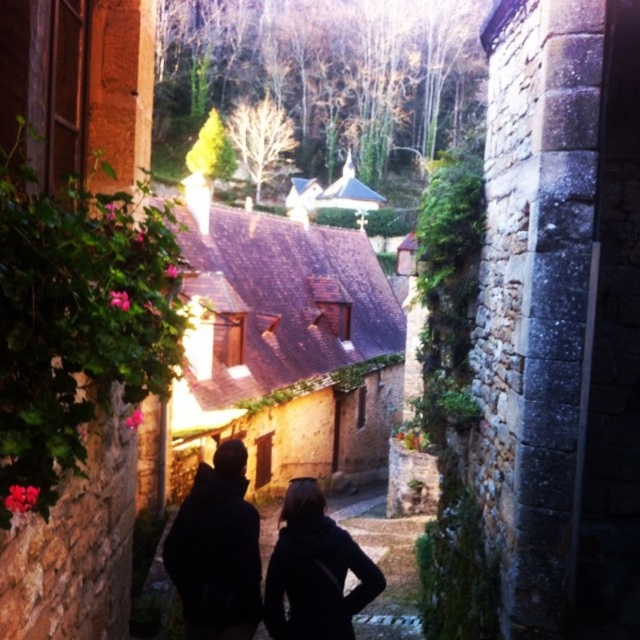
Can you confirm if black matte clothing at center is smaller than black matte jacket at center?

No, black matte clothing at center is not smaller than black matte jacket at center.

Locate an element on the screen. black matte clothing at center is located at coordinates (216, 550).

The width and height of the screenshot is (640, 640). I want to click on black matte clothing at center, so click(x=216, y=550).